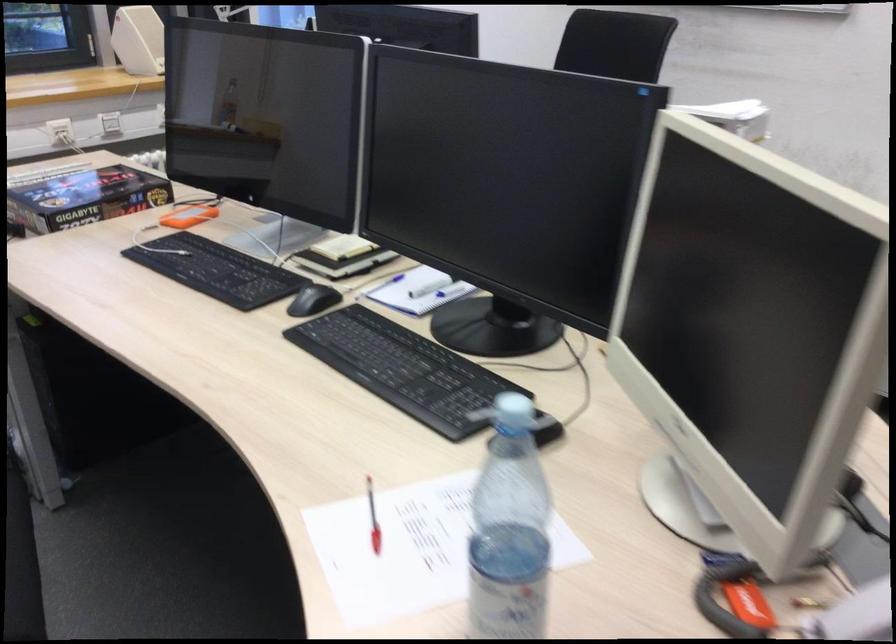
Where is `plastic water bottle`? The image size is (896, 644). plastic water bottle is located at coordinates (510, 527).